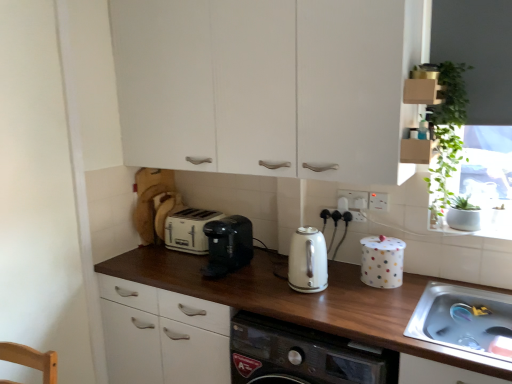
Image resolution: width=512 pixels, height=384 pixels. Find the location of `vacant area to the left of black plastic coffee maker at center, the 2th kitchen appliance when ordered from right to left`. vacant area to the left of black plastic coffee maker at center, the 2th kitchen appliance when ordered from right to left is located at coordinates (179, 268).